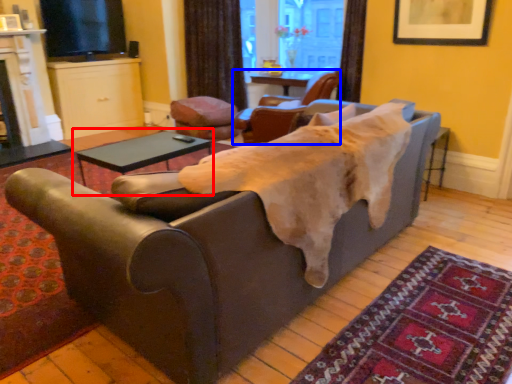
Question: Which object is further to the camera taking this photo, table (highlighted by a red box) or chair (highlighted by a blue box)?

Choices:
 (A) table
 (B) chair

Answer: (B)